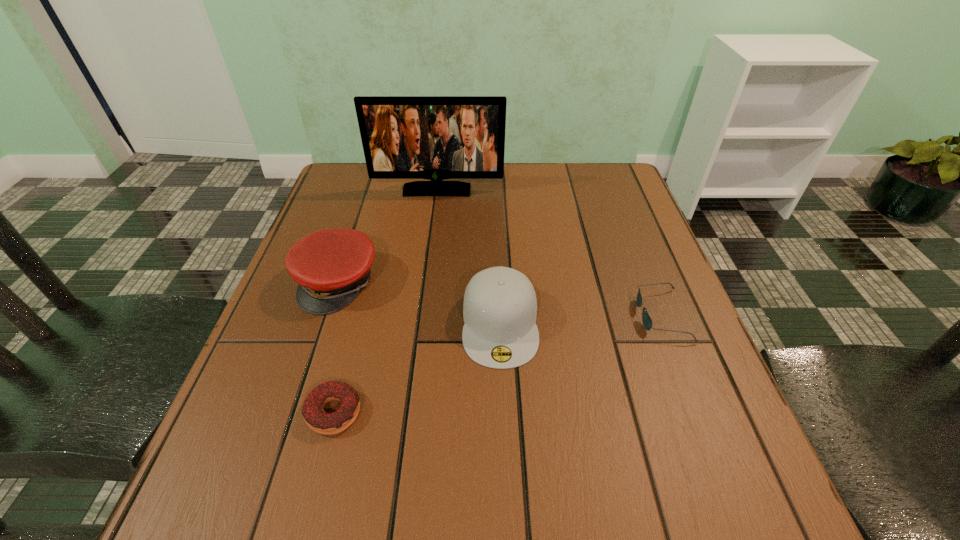
In the image, there is a desktop. Where is `vacant space at the near edge`? Image resolution: width=960 pixels, height=540 pixels. vacant space at the near edge is located at coordinates [x=404, y=478].

Where is `vacant space at the left edge`? The image size is (960, 540). vacant space at the left edge is located at coordinates (257, 429).

This screenshot has width=960, height=540. In the image, there is a desktop. What are the coordinates of `vacant space at the right edge` in the screenshot? It's located at (609, 274).

Locate an element on the screen. vacant space at the far left corner of the desktop is located at coordinates (374, 180).

Locate an element on the screen. Image resolution: width=960 pixels, height=540 pixels. vacant space at the far right corner of the desktop is located at coordinates (584, 174).

The height and width of the screenshot is (540, 960). I want to click on free space that is in between the right cap and the monitor, so click(468, 256).

I want to click on unoccupied position between the right cap and the nearest object, so click(417, 368).

At what (x,y) coordinates should I click in order to perform the action: click on empty space that is in between the left cap and the right cap. Please return your answer as a coordinate pair (x, y). Image resolution: width=960 pixels, height=540 pixels. Looking at the image, I should click on (420, 303).

I want to click on free space between the farthest object and the nearest object, so click(x=386, y=301).

Identify the location of vacant area that lies between the farthest object and the sunglasses. The image size is (960, 540). (549, 253).